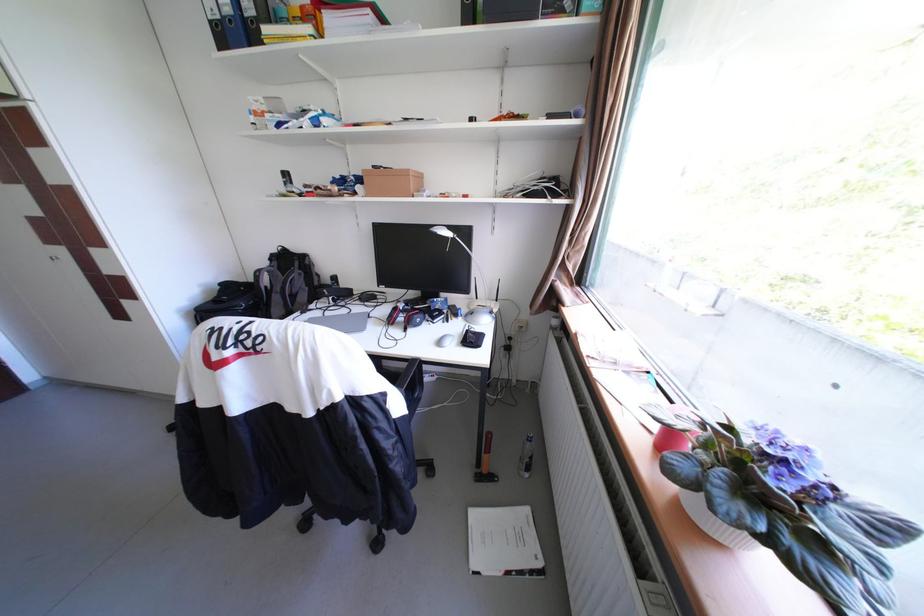
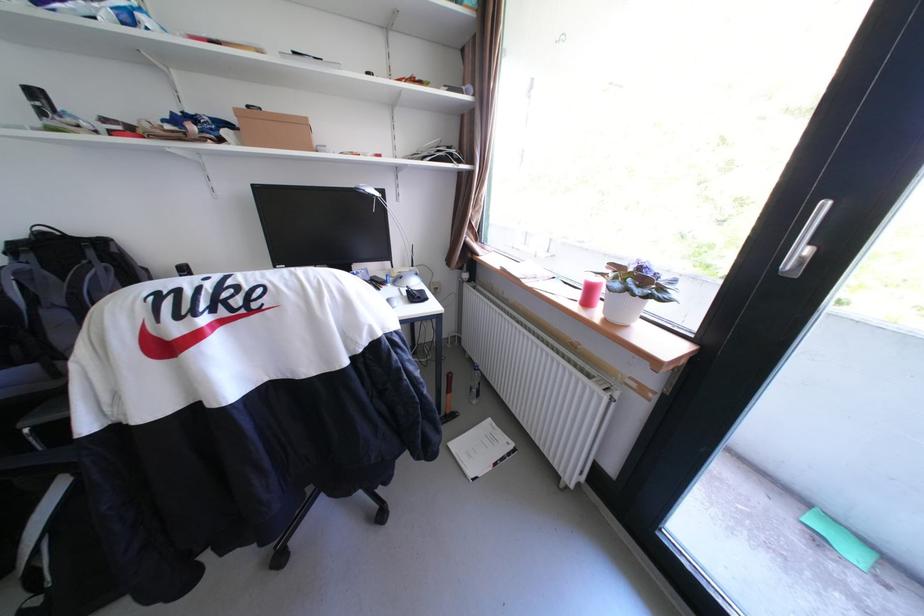
Locate, in the second image, the point that corresponds to pixel 483 515 in the first image.

(464, 446)